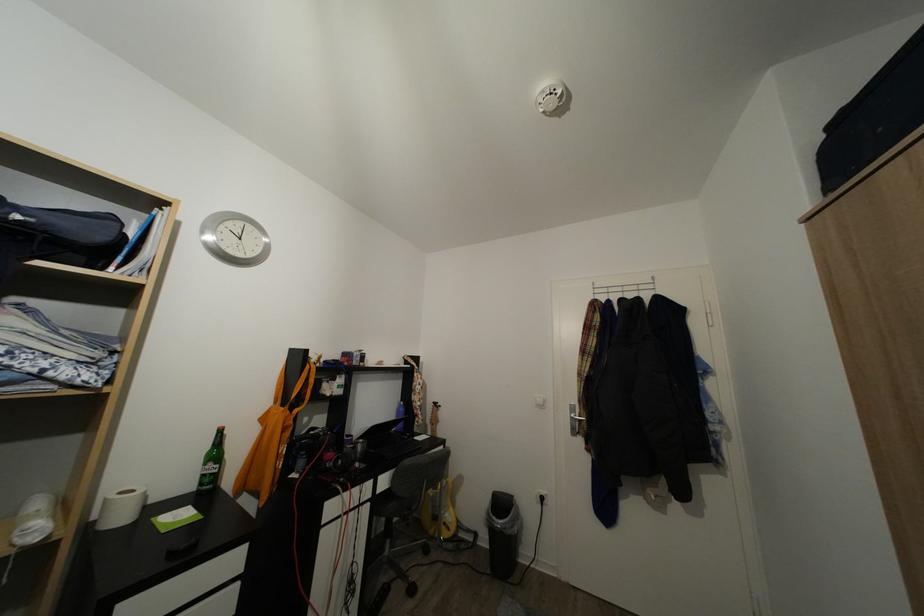
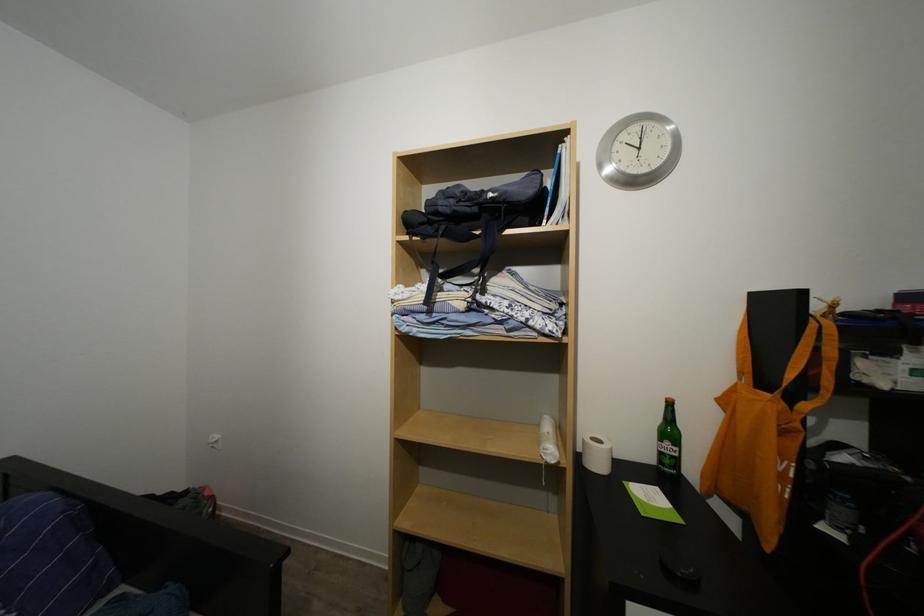
Where in the second image is the point corresponding to [229,233] from the first image?

(625, 151)